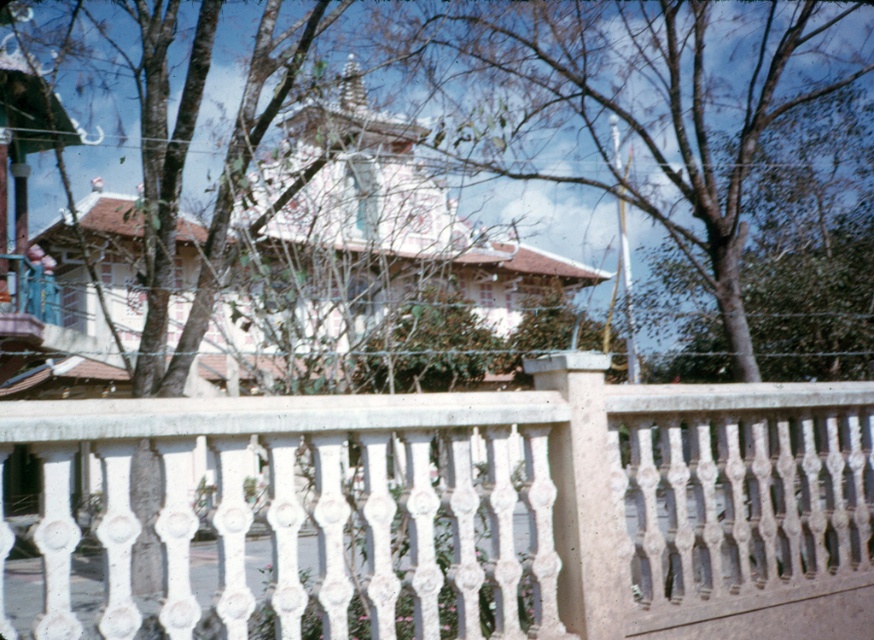
You are standing in front of a traditional building with a multi tiered roof and a white fence. There is a point at coordinates (466, 509). What object is located at this point?

The white stone fence at center is located at point (466, 509).

You are standing in front of the traditional building and want to take a photo of the white stone fence at center and the brown leafy tree at center. Which object should you focus on first to ensure both are in the frame?

The white stone fence at center is bigger than the brown leafy tree at center, so you should focus on the white stone fence at center first to ensure both are in the frame.

You are standing in front of the traditional building and want to take a photo of the brown leafy tree at center without the white stone fence at center blocking the view. Which direction should you move to ensure the tree is visible without the fence?

Move to the right side of the brown leafy tree at center so that the white stone fence at center, which is on the left of the tree, is out of the frame.